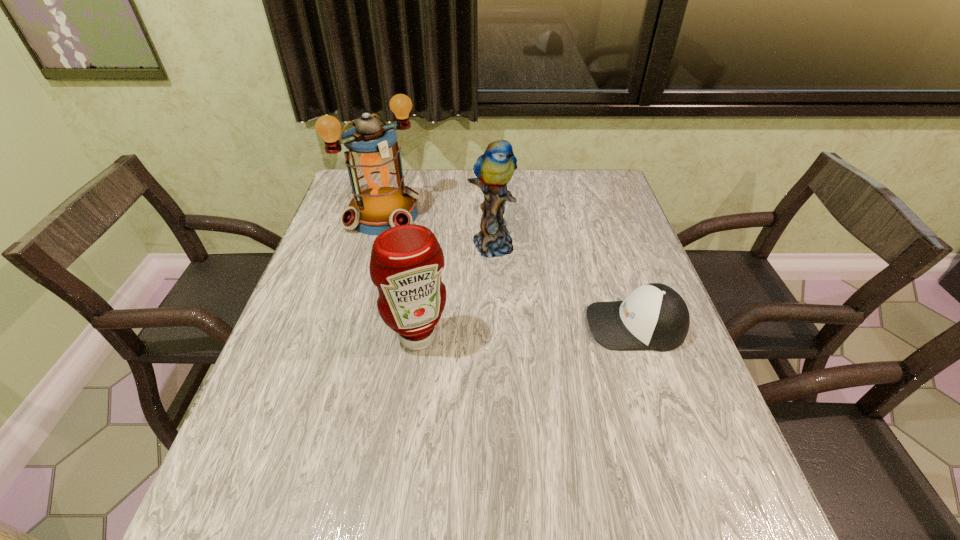
Identify the location of free space on the desktop that is between the second shortest object and the cap and is positioned on the front-facing side of the lantern. point(521,332).

The width and height of the screenshot is (960, 540). What are the coordinates of `free spot on the desktop that is between the third tallest object and the cap and is positioned on the face of the parrot` in the screenshot? It's located at (557, 329).